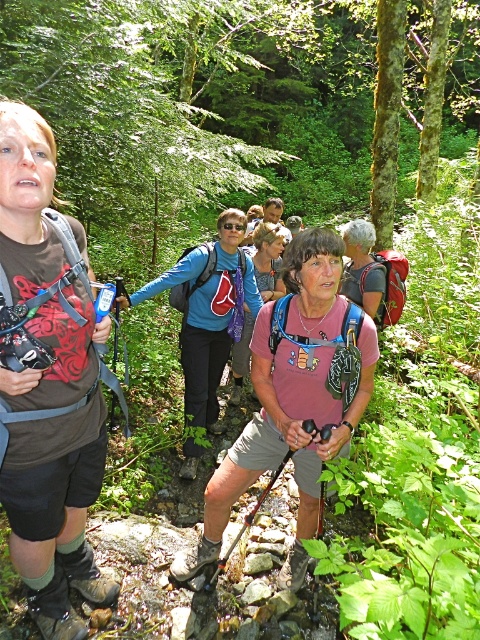
Question: Is brown fabric shirt at left above blue fabric backpack at center?

Choices:
 (A) yes
 (B) no

Answer: (B)

Question: Which object is farther from the camera taking this photo?

Choices:
 (A) pink fabric shirt at center
 (B) brown fabric shirt at left
 (C) pink fabric backpack at center

Answer: (C)

Question: Is pink fabric shirt at center wider than pink fabric backpack at center?

Choices:
 (A) no
 (B) yes

Answer: (B)

Question: Which point is farther from the camera taking this photo?

Choices:
 (A) (260, 368)
 (B) (44, 168)
 (C) (264, 285)

Answer: (C)

Question: Does brown fabric shirt at left have a larger size compared to pink fabric backpack at center?

Choices:
 (A) yes
 (B) no

Answer: (B)

Question: Which point is closer to the camera?

Choices:
 (A) pink fabric shirt at center
 (B) blue fabric backpack at center

Answer: (A)